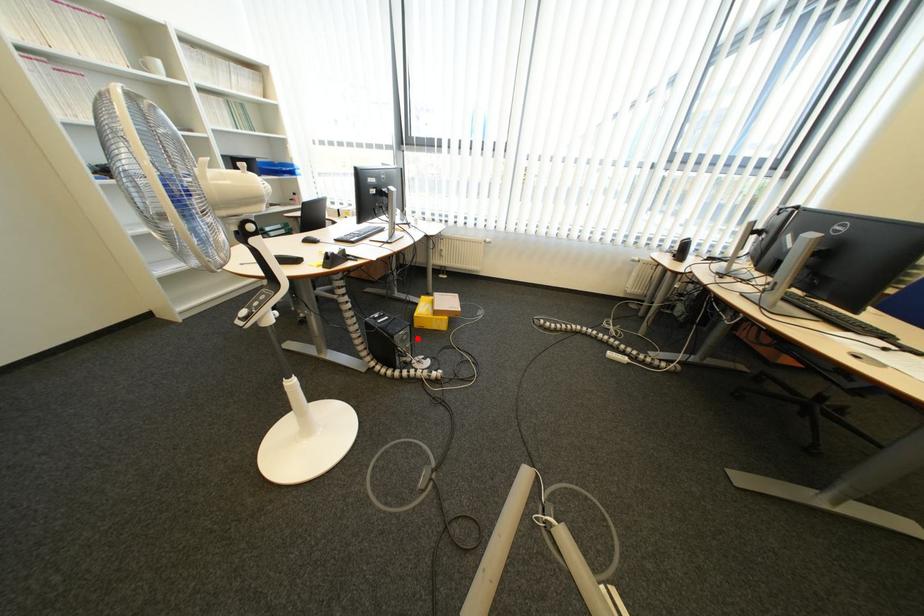
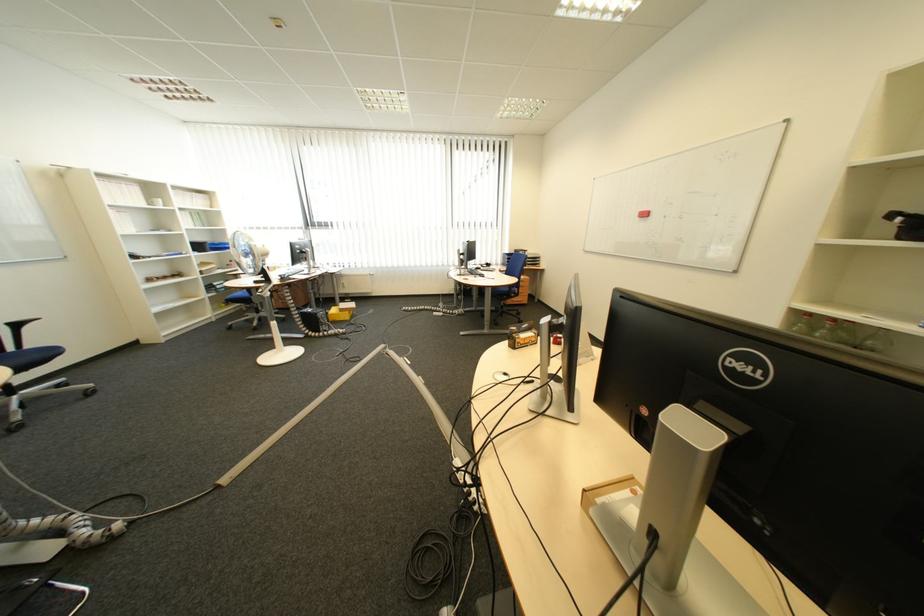
Question: I am providing you with two images of the same scene from different viewpoints. A red point is shown in image1. For the corresponding object point in image2, is it positioned nearer or farther from the camera?

Choices:
 (A) Nearer
 (B) Farther

Answer: (B)